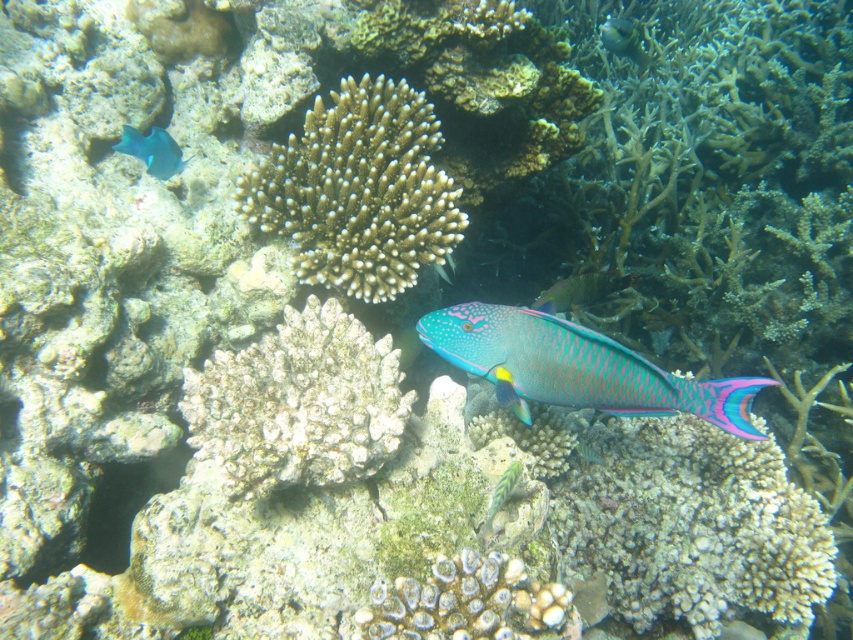
Which is more to the left, shiny iridescent fish at center or shiny blue fish at upper left?

shiny blue fish at upper left is more to the left.

Who is lower down, shiny iridescent fish at center or shiny blue fish at upper left?

shiny iridescent fish at center is below.

Between point (434, 342) and point (178, 150), which one is positioned behind?

Point (178, 150)

Identify the location of shiny iridescent fish at center. (577, 365).

Measure the distance from shiny blue-green fish at upper center to shiny green fish at center.

2.34 meters

Which of these two, shiny blue-green fish at upper center or shiny green fish at center, stands taller?

Standing taller between the two is shiny blue-green fish at upper center.

Who is more forward, (611, 17) or (492, 497)?

Point (492, 497) is more forward.

The image size is (853, 640). Identify the location of shiny blue-green fish at upper center. (622, 38).

Is point (605, 276) closer to camera compared to point (631, 49)?

Yes, point (605, 276) is closer to viewer.

Does point (608, 291) come farther from viewer compared to point (613, 40)?

No, it is not.

Locate an element on the screen. The image size is (853, 640). shiny blue-green fish at center is located at coordinates (579, 291).

In order to click on shiny blue-green fish at center in this screenshot , I will do `click(579, 291)`.